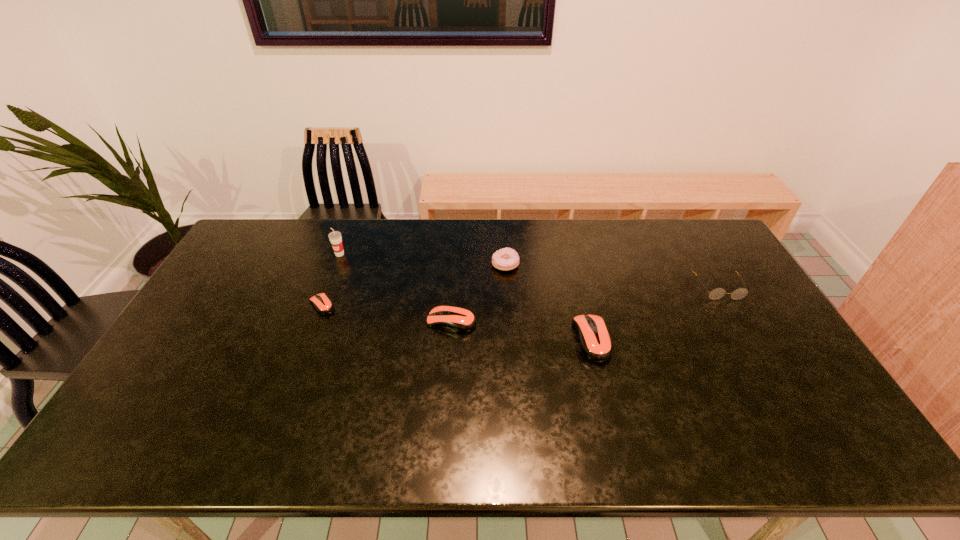
Locate an element on the screen. empty space that is in between the spectacles and the leftmost computer mouse is located at coordinates (520, 296).

Locate which object ranks second in proximity to the spectacles. Please provide its 2D coordinates. Your answer should be formatted as a tuple, i.e. [(x, y)], where the tuple contains the x and y coordinates of a point satisfying the conditions above.

[(505, 259)]

The width and height of the screenshot is (960, 540). What are the coordinates of `the fourth closest object to the spectacles` in the screenshot? It's located at (323, 305).

Choose which computer mouse is the nearest neighbor to the rightmost object. Please provide its 2D coordinates. Your answer should be formatted as a tuple, i.e. [(x, y)], where the tuple contains the x and y coordinates of a point satisfying the conditions above.

[(595, 342)]

You are a GUI agent. You are given a task and a screenshot of the screen. Output one action in this format:
    pyautogui.click(x=<x>, y=<y>)
    Task: Click on the computer mouse that is the nearest to the tallest object
    This screenshot has height=540, width=960.
    Given the screenshot: What is the action you would take?
    pyautogui.click(x=323, y=305)

Where is `free location that satisfies the following two spatial constraints: 1. on the side of the tallest object with the logo; 2. on the left side of the rightmost computer mouse`? Image resolution: width=960 pixels, height=540 pixels. free location that satisfies the following two spatial constraints: 1. on the side of the tallest object with the logo; 2. on the left side of the rightmost computer mouse is located at coordinates (307, 340).